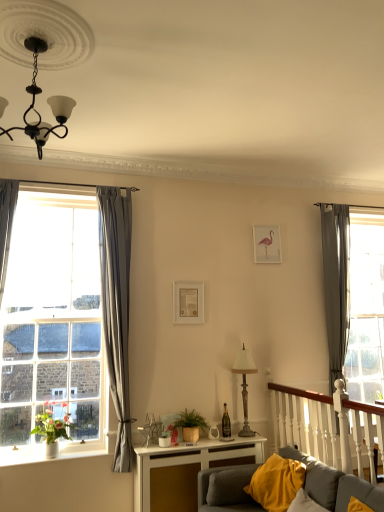
This screenshot has height=512, width=384. Find the location of `free space above white ceramic vase at lower left (from a real-world perspective)`. free space above white ceramic vase at lower left (from a real-world perspective) is located at coordinates (73, 454).